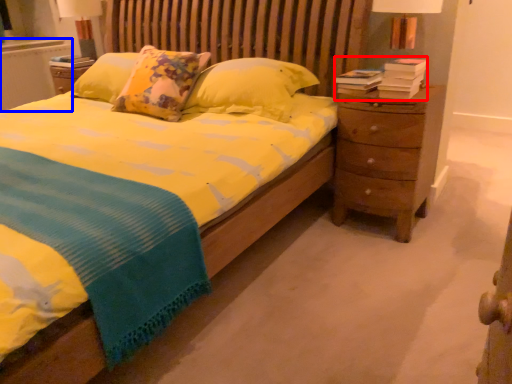
Question: Among these objects, which one is nearest to the camera, book (highlighted by a red box) or radiator (highlighted by a blue box)?

Choices:
 (A) book
 (B) radiator

Answer: (A)